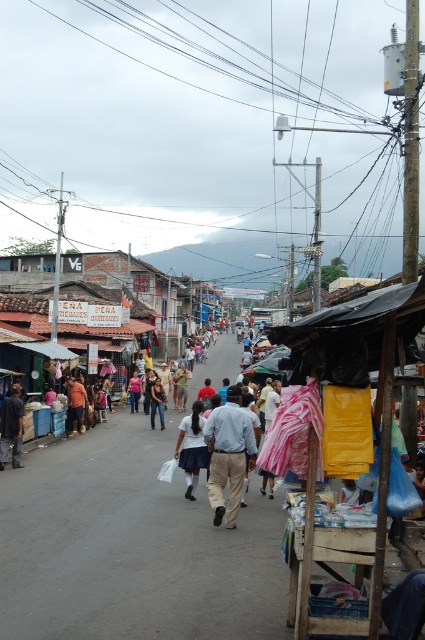
Is point (187, 81) positioned after point (76, 384)?

That is True.

Which is in front, point (314, 129) or point (76, 404)?

Point (76, 404)

Locate an element on the screen. The width and height of the screenshot is (425, 640). black plastic power line at upper center is located at coordinates (144, 61).

Is white matte skirt at center taller than dark brown leather shoes at center?

No.

Is white matte skirt at center positioned behind dark brown leather shoes at center?

That is False.

Does point (198, 429) lie behind point (68, 408)?

That is False.

Where is `white matte skirt at center`? white matte skirt at center is located at coordinates (192, 448).

Can you confirm if white matte skirt at center is thinner than dark blue dress at center?

No.

The height and width of the screenshot is (640, 425). What do you see at coordinates (192, 448) in the screenshot? I see `white matte skirt at center` at bounding box center [192, 448].

This screenshot has width=425, height=640. I want to click on white matte skirt at center, so click(x=192, y=448).

Locate an element on the screen. The height and width of the screenshot is (640, 425). white matte skirt at center is located at coordinates (192, 448).